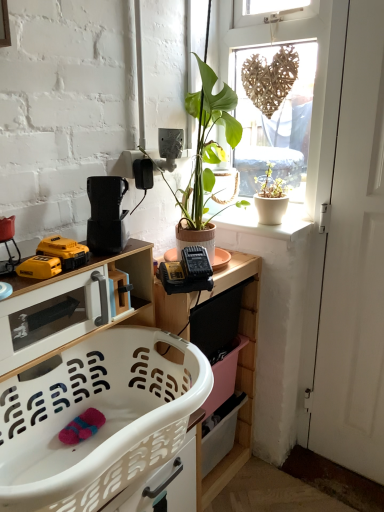
Where is `blank space above white glossy cabinet at lower left, the 2th cabinetry in the bottom-to-top sequence (from a real-world perspective)`? The height and width of the screenshot is (512, 384). blank space above white glossy cabinet at lower left, the 2th cabinetry in the bottom-to-top sequence (from a real-world perspective) is located at coordinates (37, 286).